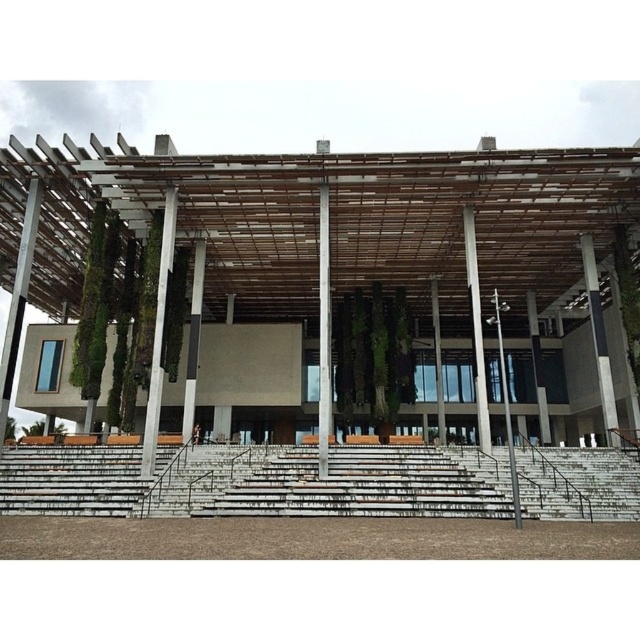
Question: Which of the following is the closest to the observer?

Choices:
 (A) white concrete pillar at center
 (B) smooth concrete pillar at center
 (C) white concrete stairs at lower center
 (D) wooden lattice structure at center

Answer: (D)

Question: Is wooden lattice structure at center to the right of green mossy pillar at center from the viewer's perspective?

Choices:
 (A) yes
 (B) no

Answer: (A)

Question: Which of these objects is positioned farthest from the green mossy pillar at center?

Choices:
 (A) wooden lattice structure at center
 (B) white concrete stairs at lower center
 (C) smooth concrete pillar at center

Answer: (A)

Question: Which is farther from the green mossy pillar at center?

Choices:
 (A) white concrete pillar at center
 (B) wooden lattice structure at center
 (C) white concrete stairs at lower center
 (D) smooth concrete pillar at center

Answer: (A)

Question: Is wooden lattice structure at center positioned in front of white concrete pillar at center?

Choices:
 (A) no
 (B) yes

Answer: (B)

Question: In this image, where is wooden lattice structure at center located relative to green mossy pillar at center?

Choices:
 (A) below
 (B) above

Answer: (B)